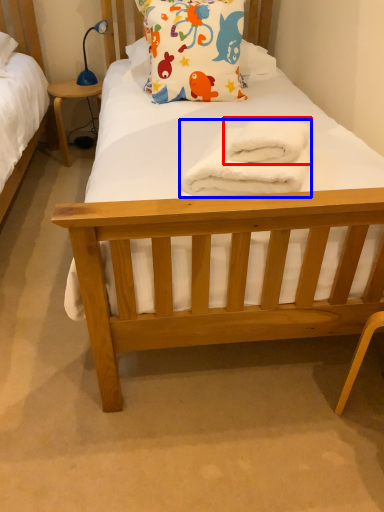
Question: Which object is closer to the camera taking this photo, bath towel (highlighted by a red box) or towel/napkin (highlighted by a blue box)?

Choices:
 (A) bath towel
 (B) towel/napkin

Answer: (B)